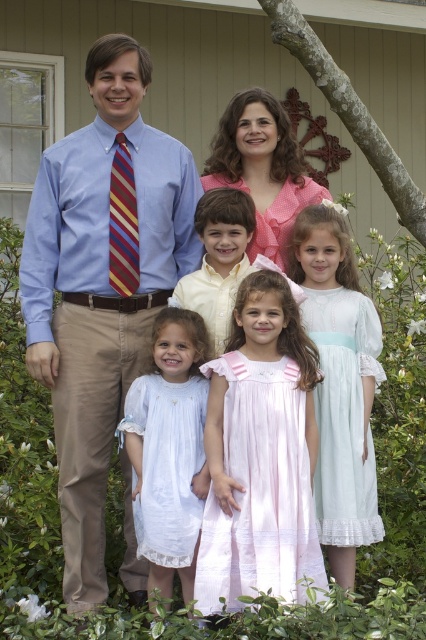
Question: Estimate the real-world distances between objects in this image. Which object is farther from the light blue sheer dress at center?

Choices:
 (A) white lace dress at center
 (B) yellow cotton shirt at center
 (C) striped fabric tie at left
 (D) pink polka dot dress at center

Answer: (C)

Question: Among these points, which one is farthest from the camera?

Choices:
 (A) (362, 486)
 (B) (121, 147)

Answer: (B)

Question: Which is farther from the pink satin dress at center?

Choices:
 (A) matte blue shirt at center
 (B) yellow cotton shirt at center

Answer: (A)

Question: Does matte blue shirt at center lie behind white lace dress at center?

Choices:
 (A) no
 (B) yes

Answer: (B)

Question: Is matte blue shirt at center smaller than pink polka dot dress at center?

Choices:
 (A) no
 (B) yes

Answer: (A)

Question: Does matte blue shirt at center have a smaller size compared to light blue sheer dress at center?

Choices:
 (A) no
 (B) yes

Answer: (A)